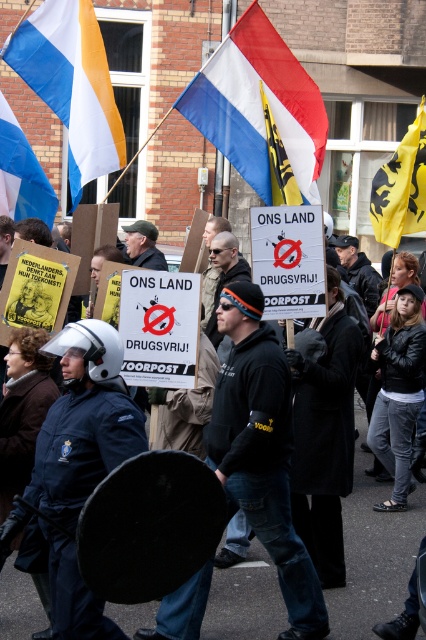
Is tri-color fabric flag at center bigger than blue fabric flag at upper left?

Yes.

Is tri-color fabric flag at center further to camera compared to blue fabric flag at upper left?

No, it is in front of blue fabric flag at upper left.

Identify the location of tri-color fabric flag at center. This screenshot has height=640, width=426. (261, 112).

Identify the location of tri-color fabric flag at center. (261, 112).

From the picture: Between tri-color fabric flag at center and blue and white striped flag at center, which one has less height?

blue and white striped flag at center

Where is `tri-color fabric flag at center`? tri-color fabric flag at center is located at coordinates (261, 112).

Who is taller, blue uniform at center or tri-color fabric flag at center?

tri-color fabric flag at center

Who is positioned more to the left, blue uniform at center or tri-color fabric flag at center?

tri-color fabric flag at center

Identify the location of blue uniform at center. (373, 552).